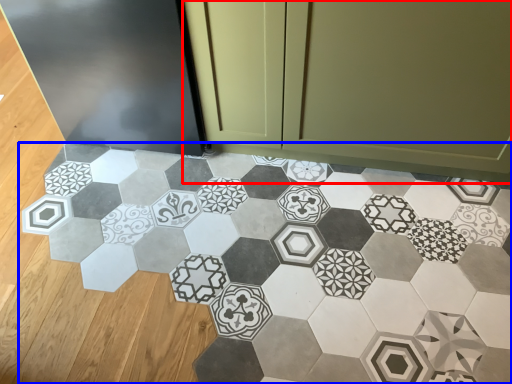
Question: Among these objects, which one is farthest to the camera, cabinetry (highlighted by a red box) or ceramic tile (highlighted by a blue box)?

Choices:
 (A) cabinetry
 (B) ceramic tile

Answer: (A)